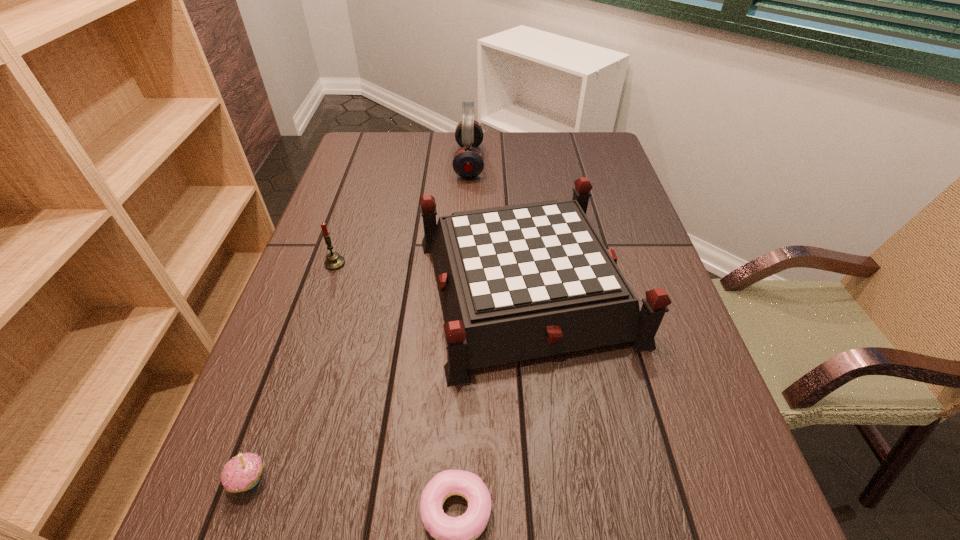
This screenshot has height=540, width=960. I want to click on candle that is at the left edge, so click(x=334, y=261).

Find the location of `cupcake that is at the left edge`. cupcake that is at the left edge is located at coordinates (241, 473).

Find the location of `object located at the right edge`. object located at the right edge is located at coordinates (517, 282).

Identify the location of vacant space at the far edge of the desktop. This screenshot has height=540, width=960. (423, 166).

Locate an element on the screen. The image size is (960, 540). free space at the left edge is located at coordinates (310, 268).

This screenshot has height=540, width=960. In the image, there is a desktop. In order to click on vacant space at the right edge in this screenshot , I will do `click(730, 471)`.

The height and width of the screenshot is (540, 960). In the image, there is a desktop. In order to click on free space at the far left corner in this screenshot , I will do `click(372, 170)`.

Identify the location of free space at the far right corner of the desktop. [576, 164].

The width and height of the screenshot is (960, 540). I want to click on vacant space that's between the tallest object and the third tallest object, so click(402, 213).

This screenshot has height=540, width=960. What are the coordinates of `empty space that is in between the second shortest object and the third shortest object` in the screenshot? It's located at pos(292,372).